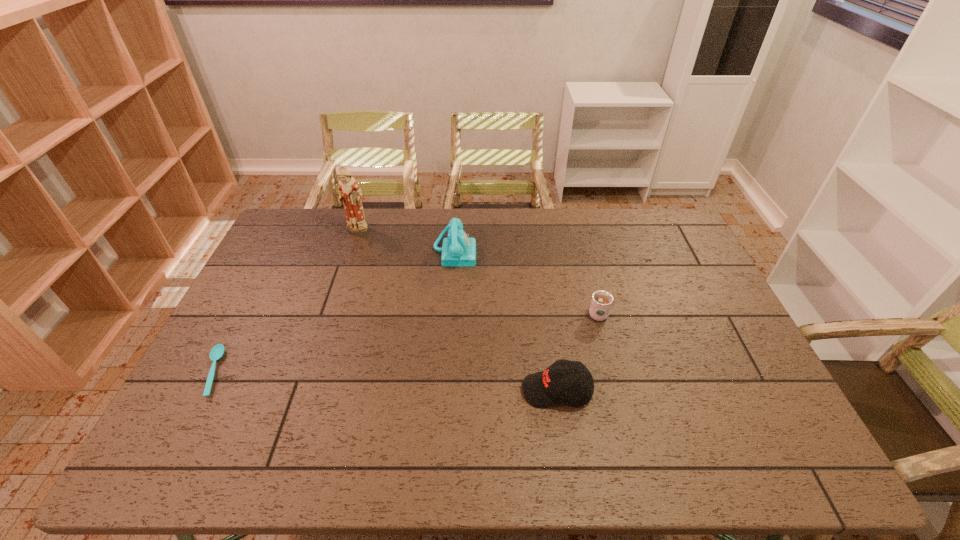
Identify the location of free space located on the dial of the telephone. (521, 252).

I want to click on vacant area situated 0.220m on the side with the handle of the third nearest object, so (x=583, y=256).

The image size is (960, 540). I want to click on vacant space located 0.100m on the side with the handle of the third nearest object, so click(x=588, y=280).

Identify the location of vacant space located 0.050m on the side with the handle of the third nearest object. The width and height of the screenshot is (960, 540). (591, 291).

The image size is (960, 540). I want to click on vacant space located 0.310m on the front-facing side of the baseball cap, so click(402, 390).

You are a GUI agent. You are given a task and a screenshot of the screen. Output one action in this format:
    pyautogui.click(x=<x>, y=<y>)
    Task: Click on the vacant region located 0.050m on the front-facing side of the baseball cap
    The image size is (960, 540).
    Given the screenshot: What is the action you would take?
    pyautogui.click(x=502, y=390)

Locate an element on the screen. The height and width of the screenshot is (540, 960). vacant space located on the front-facing side of the baseball cap is located at coordinates (468, 390).

The height and width of the screenshot is (540, 960). I want to click on vacant space located on the right of the spoon, so click(x=299, y=372).

I want to click on figurine situated at the far edge, so click(350, 194).

Locate an element on the screen. telephone present at the far edge is located at coordinates (459, 250).